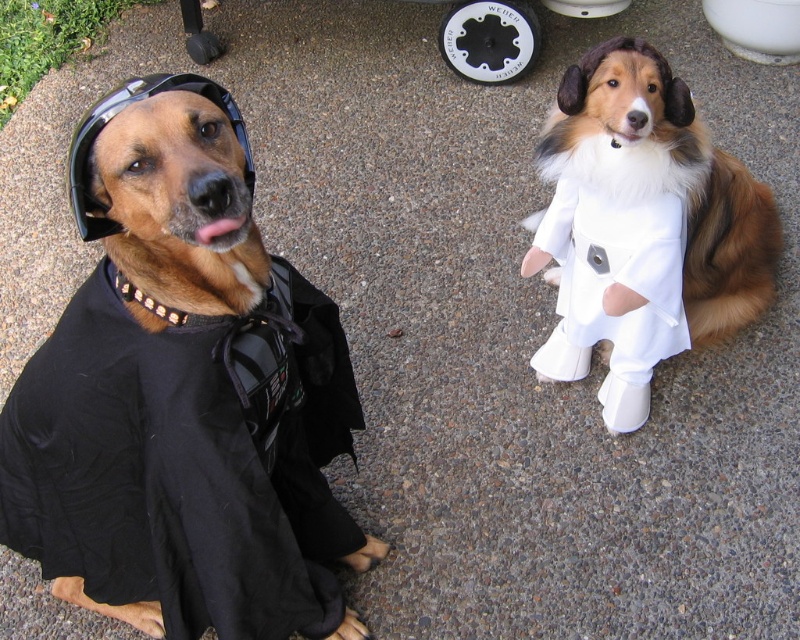
You are a photographer setting up a shoot with two dogs wearing costumes. The black matte shirt at left is worn by a dog on the left, and the white fur dress at right is worn by the dog on the right. You need to decide which costume requires more space for movement. Based on their descriptions, which costume would you say needs more space?

The white fur dress at right requires more space for movement because it is thicker than the black matte shirt at left, which might limit mobility.

You are a photographer trying to capture a photo of both the black matte shirt at left and the white fur dress at right. Since you want to ensure both are visible in the frame, which direction should you position your camera relative to the dogs?

You should position your camera to the right side of the dogs so that both the black matte shirt at left and the white fur dress at right are visible in the frame. This way, the camera can capture the entire arrangement from the leftmost point of the black matte shirt at left to the rightmost point of the white fur dress at right.